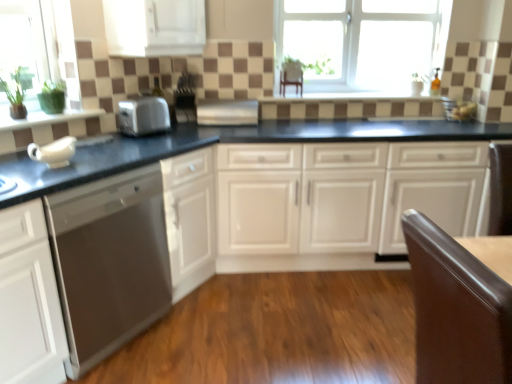
Where is `spots to the right of satin silver toaster at center`? spots to the right of satin silver toaster at center is located at coordinates click(x=177, y=138).